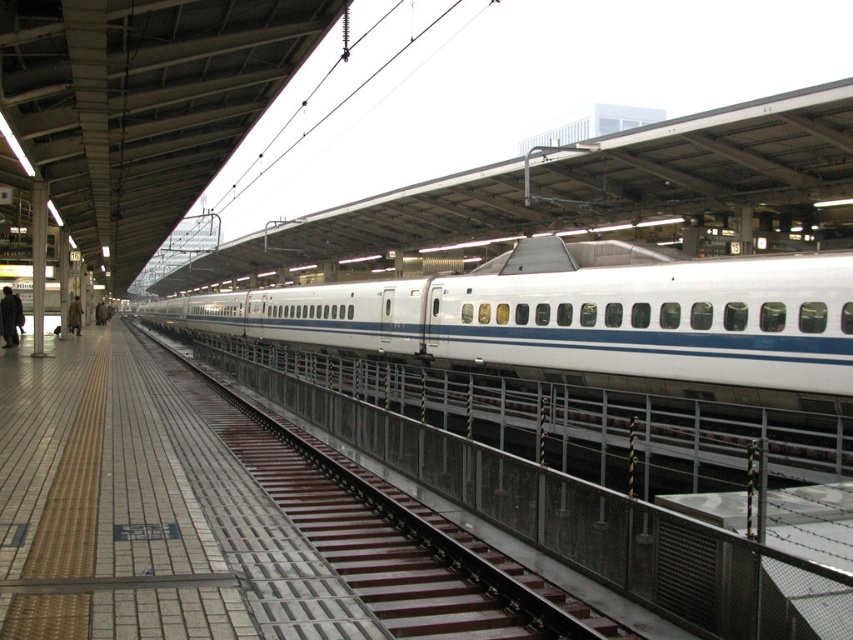
Who is positioned more to the right, dark clothing at platform left or brown leather coat at left?

dark clothing at platform left

Can you confirm if dark clothing at platform left is bigger than brown leather coat at left?

Actually, dark clothing at platform left might be smaller than brown leather coat at left.

Which is behind, point (9, 344) or point (80, 310)?

Point (80, 310)

You are a GUI agent. You are given a task and a screenshot of the screen. Output one action in this format:
    pyautogui.click(x=<x>, y=<y>)
    Task: Click on the dark clothing at platform left
    
    Given the screenshot: What is the action you would take?
    pyautogui.click(x=9, y=316)

The width and height of the screenshot is (853, 640). What do you see at coordinates (584, 320) in the screenshot?
I see `white smooth passenger train at center` at bounding box center [584, 320].

Who is lower down, white smooth passenger train at center or dark clothing at platform left?

Positioned lower is dark clothing at platform left.

This screenshot has width=853, height=640. Identify the location of white smooth passenger train at center. (584, 320).

Who is shorter, white smooth passenger train at center or brown leather coat at left?

Standing shorter between the two is brown leather coat at left.

Between white smooth passenger train at center and brown leather coat at left, which one appears on the right side from the viewer's perspective?

From the viewer's perspective, white smooth passenger train at center appears more on the right side.

At what (x,y) coordinates should I click in order to perform the action: click on white smooth passenger train at center. Please return your answer as a coordinate pair (x, y). Image resolution: width=853 pixels, height=640 pixels. Looking at the image, I should click on (584, 320).

Where is `white smooth passenger train at center`? This screenshot has width=853, height=640. white smooth passenger train at center is located at coordinates (584, 320).